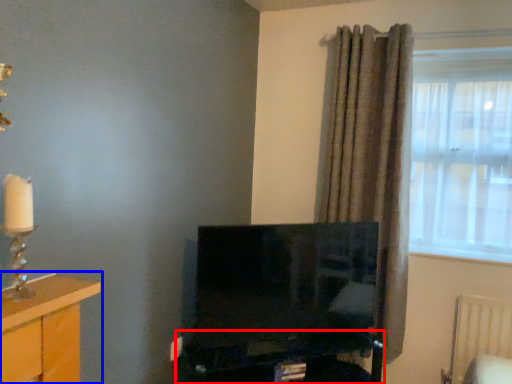
Question: Which object is closer to the camera taking this photo, computer desk (highlighted by a red box) or furniture (highlighted by a blue box)?

Choices:
 (A) computer desk
 (B) furniture

Answer: (B)